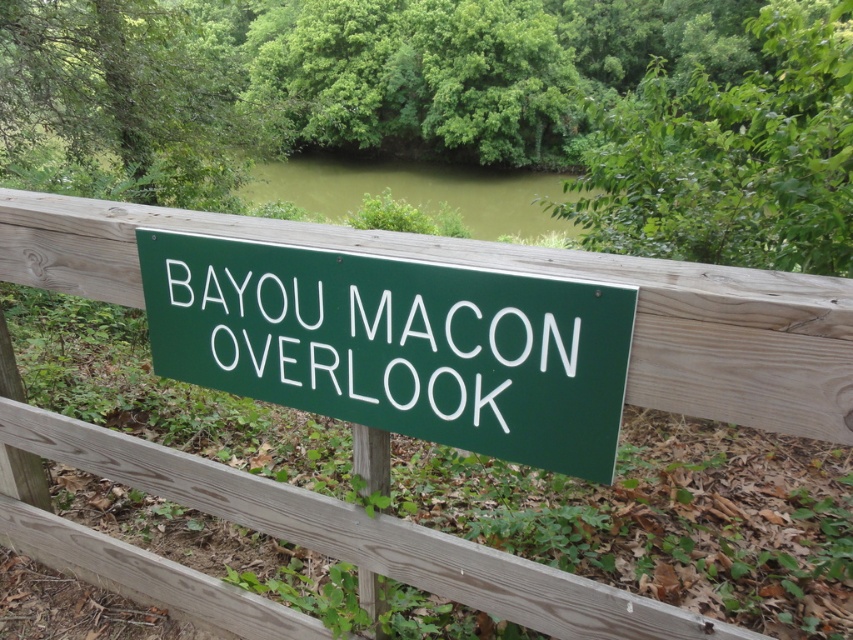
You are standing at the BAYOU MACON OVERLOOK and want to see the green murky water at upper center. Which direction should you look relative to the green wood fence at center?

The green wood fence at center is below the green murky water at upper center, so you should look upward from the green wood fence at center to see the green murky water at upper center.